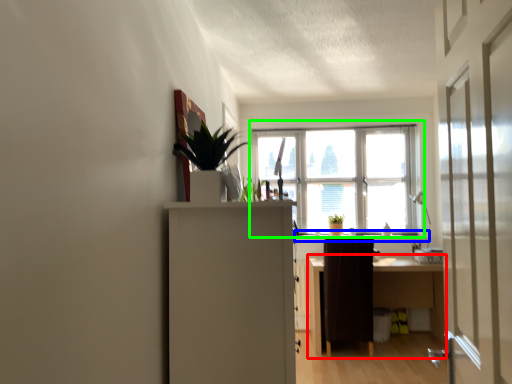
Question: Considering the real-world distances, which object is closest to desk (highlighted by a red box)? window sill (highlighted by a blue box) or window (highlighted by a green box).

Choices:
 (A) window sill
 (B) window

Answer: (A)